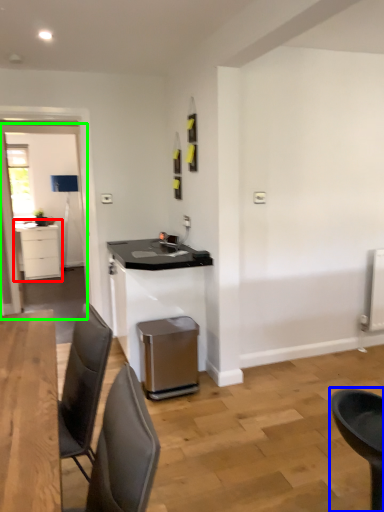
Question: Based on their relative distances, which object is nearer to cabinetry (highlighted by a red box)? Choose from chair (highlighted by a blue box) and glass door (highlighted by a green box).

Choices:
 (A) chair
 (B) glass door

Answer: (B)